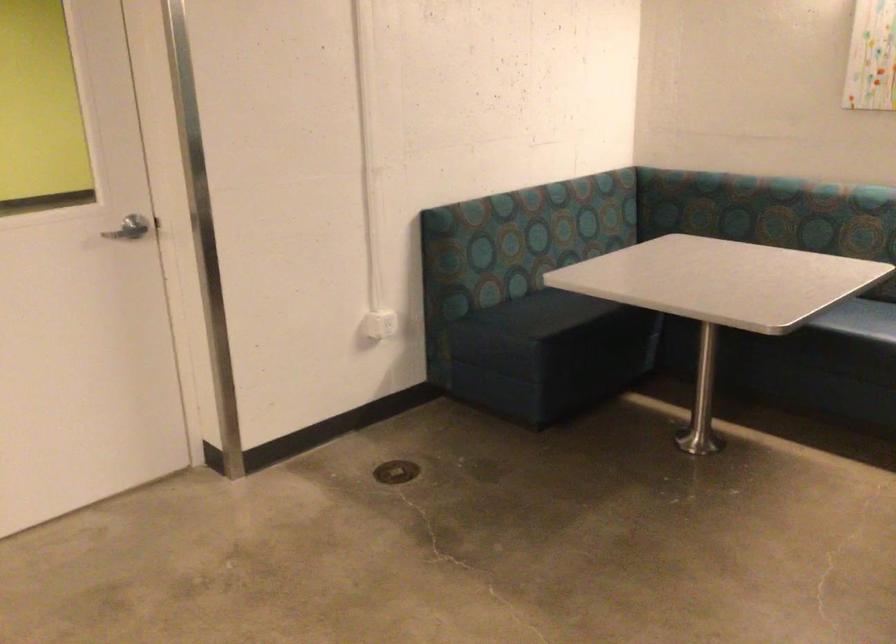
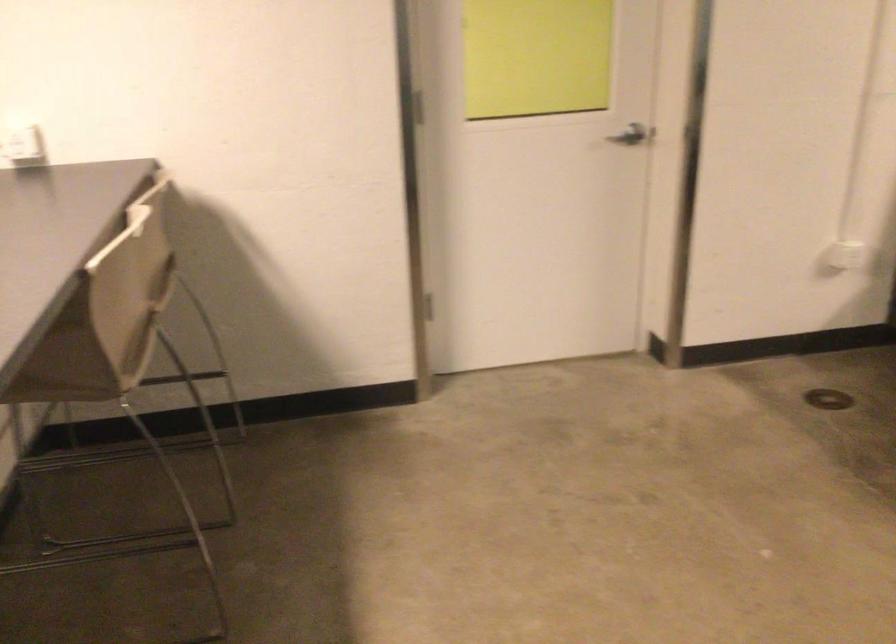
The point at (140, 228) is marked in the first image. Where is the corresponding point in the second image?

(629, 136)